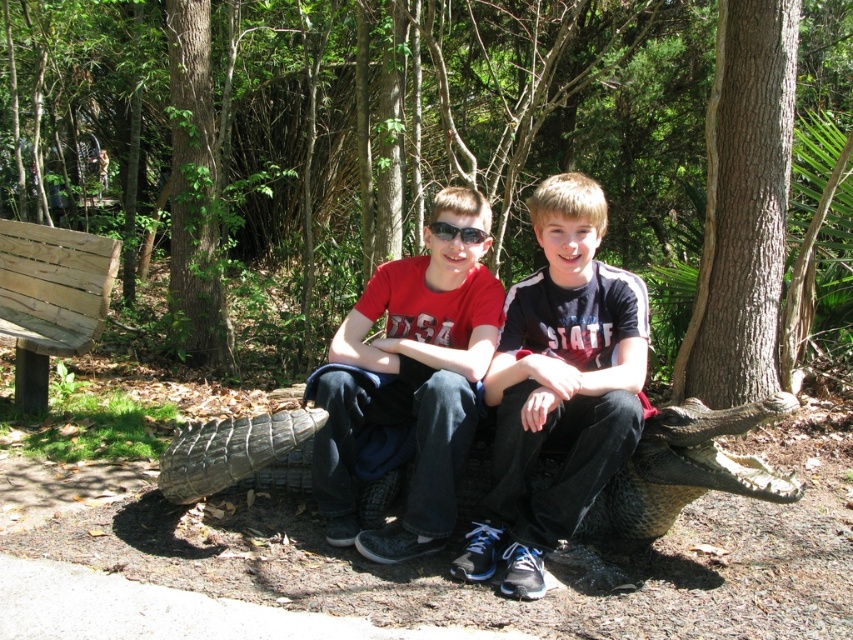
From the picture: You are a photographer trying to capture a photo of the green textured tree at center and the matte black shirt at center. Which object should you zoom in on more to ensure both are in focus?

The green textured tree at center is thinner than the matte black shirt at center, so you should zoom in more on the matte black shirt at center to ensure both are in focus.

You are standing in front of the alligator sculpture and want to place a small flag at the point that is closer to you. Which point should you choose between point (x=561, y=364) and point (x=4, y=280)?

Point (x=561, y=364) is closer to the camera, so you should place the flag at point (x=561, y=364).

You are standing in the park and see the large artificial alligator sculpture. There is a specific point at coordinates (558, 387). Can you tell me which object this point is located on?

The point at coordinates (558, 387) is located on the matte black shirt at center.